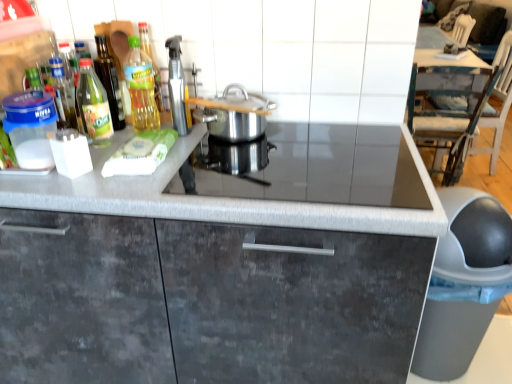
At what (x,y) coordinates should I click in order to perform the action: click on free space above matte gray cabinet at center (from a real-world perspective). Please return your answer as a coordinate pair (x, y). The width and height of the screenshot is (512, 384). Looking at the image, I should click on (213, 174).